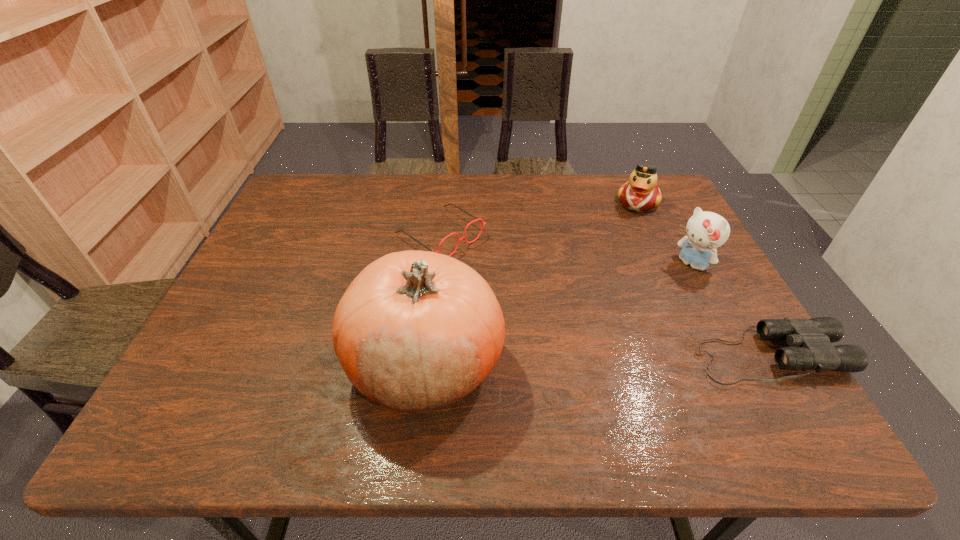
You are a GUI agent. You are given a task and a screenshot of the screen. Output one action in this format:
    pyautogui.click(x=<x>, y=<y>)
    Task: Click on the tallest object
    
    Given the screenshot: What is the action you would take?
    pyautogui.click(x=416, y=330)

Where is `the shortest object`? This screenshot has height=540, width=960. the shortest object is located at coordinates pyautogui.click(x=811, y=339).

Identify the location of the second shortest object. (464, 238).

Find the location of a particular element. This screenshot has height=540, width=960. kitten is located at coordinates (706, 231).

Find the location of `the third shortest object`. the third shortest object is located at coordinates (641, 193).

Where is `vacant point located on the right of the pumpkin`? The image size is (960, 540). vacant point located on the right of the pumpkin is located at coordinates (645, 363).

What are the coordinates of `free region located 0.330m on the front-facing side of the fourth tallest object` in the screenshot? It's located at (573, 321).

Locate an element on the screen. This screenshot has height=540, width=960. vacant space situated 0.280m on the front-facing side of the fourth tallest object is located at coordinates (556, 310).

The width and height of the screenshot is (960, 540). What are the coordinates of `vacant area situated 0.110m on the front-facing side of the fourth tallest object` in the screenshot? It's located at (502, 275).

Image resolution: width=960 pixels, height=540 pixels. I want to click on vacant space situated on the front-facing side of the kitten, so click(x=619, y=322).